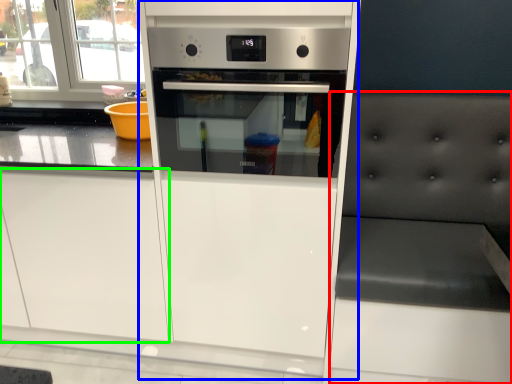
Question: Which is nearer to the chair (highlighted by a red box)? fridge (highlighted by a blue box) or drawer (highlighted by a green box).

Choices:
 (A) fridge
 (B) drawer

Answer: (A)